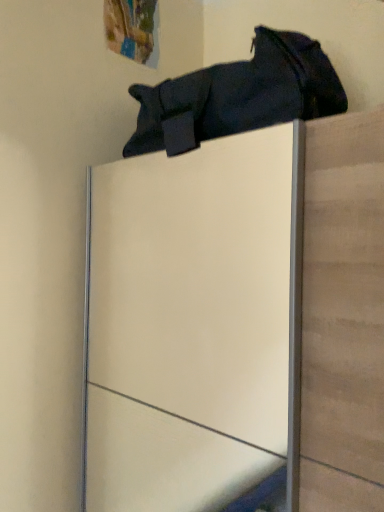
Question: Is dark fabric bag at upper center outside white glossy cabinet at upper center?

Choices:
 (A) no
 (B) yes

Answer: (B)

Question: Is dark fabric bag at upper center oriented towards white glossy cabinet at upper center?

Choices:
 (A) yes
 (B) no

Answer: (B)

Question: Considering the relative positions of dark fabric bag at upper center and white glossy cabinet at upper center in the image provided, is dark fabric bag at upper center to the right of white glossy cabinet at upper center from the viewer's perspective?

Choices:
 (A) no
 (B) yes

Answer: (A)

Question: Does dark fabric bag at upper center touch white glossy cabinet at upper center?

Choices:
 (A) yes
 (B) no

Answer: (B)

Question: Considering the relative sizes of dark fabric bag at upper center and white glossy cabinet at upper center in the image provided, is dark fabric bag at upper center taller than white glossy cabinet at upper center?

Choices:
 (A) yes
 (B) no

Answer: (B)

Question: Does dark fabric bag at upper center have a larger size compared to white glossy cabinet at upper center?

Choices:
 (A) yes
 (B) no

Answer: (B)

Question: Is white glossy cabinet at upper center outside of dark fabric bag at upper center?

Choices:
 (A) no
 (B) yes

Answer: (B)

Question: Is white glossy cabinet at upper center behind dark fabric bag at upper center?

Choices:
 (A) yes
 (B) no

Answer: (B)

Question: Could you tell me if white glossy cabinet at upper center is facing dark fabric bag at upper center?

Choices:
 (A) no
 (B) yes

Answer: (A)

Question: Can you confirm if white glossy cabinet at upper center is positioned to the right of dark fabric bag at upper center?

Choices:
 (A) yes
 (B) no

Answer: (A)

Question: Can dark fabric bag at upper center be found inside white glossy cabinet at upper center?

Choices:
 (A) yes
 (B) no

Answer: (B)

Question: Can you confirm if white glossy cabinet at upper center is thinner than dark fabric bag at upper center?

Choices:
 (A) yes
 (B) no

Answer: (B)

Question: From a real-world perspective, is dark fabric bag at upper center physically located above or below white glossy cabinet at upper center?

Choices:
 (A) below
 (B) above

Answer: (B)